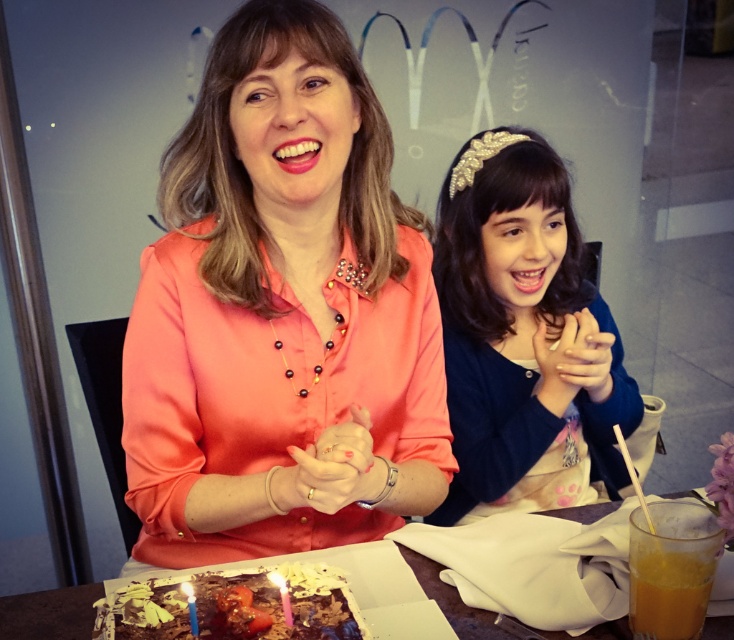
Is chocolate cake at lower center above matte yellow candle at lower left?

Incorrect, chocolate cake at lower center is not positioned above matte yellow candle at lower left.

Locate an element on the screen. chocolate cake at lower center is located at coordinates (48, 612).

Locate an element on the screen. The height and width of the screenshot is (640, 734). chocolate cake at lower center is located at coordinates (48, 612).

Is the position of matte gold headband at center more distant than that of matte yellow candle at lower left?

Yes, matte gold headband at center is behind matte yellow candle at lower left.

Who is shorter, matte gold headband at center or matte yellow candle at lower left?

Standing shorter between the two is matte yellow candle at lower left.

Between point (581, 307) and point (269, 572), which one is positioned in front?

Point (269, 572) is in front.

At what (x,y) coordinates should I click in order to perform the action: click on matte gold headband at center. Please return your answer as a coordinate pair (x, y). Looking at the image, I should click on (523, 333).

Is matte gold headband at center shorter than chocolate cake at lower center?

In fact, matte gold headband at center may be taller than chocolate cake at lower center.

Is matte gold headband at center bigger than chocolate cake at lower center?

Correct, matte gold headband at center is larger in size than chocolate cake at lower center.

This screenshot has height=640, width=734. In order to click on matte gold headband at center in this screenshot , I will do `click(523, 333)`.